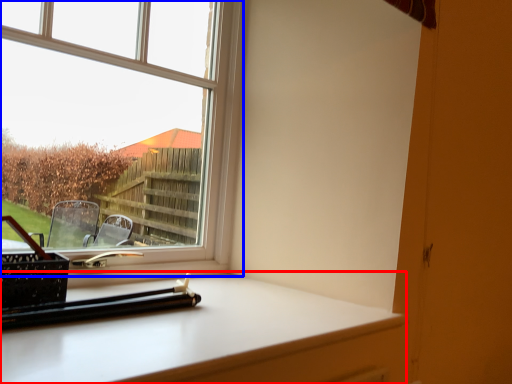
Question: Which point is further to the camera, computer desk (highlighted by a red box) or window (highlighted by a blue box)?

Choices:
 (A) computer desk
 (B) window

Answer: (B)